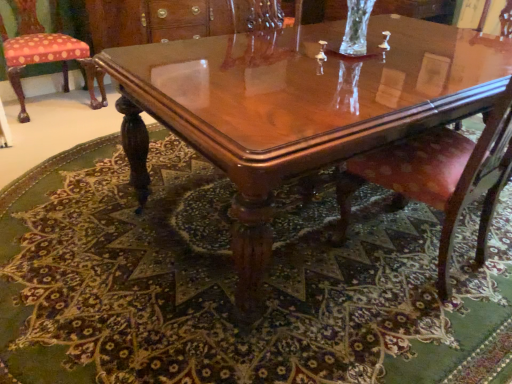
Question: From a real-world perspective, is polka dot fabric cushion at left, marked as the 1th chair in a top-to-bottom arrangement, above or below carpeted floor at center?

Choices:
 (A) below
 (B) above

Answer: (B)

Question: From the image's perspective, relative to carpeted floor at center, is polka dot fabric cushion at left, marked as the 1th chair in a top-to-bottom arrangement, above or below?

Choices:
 (A) below
 (B) above

Answer: (B)

Question: Based on their relative distances, which object is nearer to the polka dot fabric cushion at left, the 2th chair from the front?

Choices:
 (A) pink velvet chair at center, acting as the second chair starting from the left
 (B) carpeted floor at center
 (C) glossy wood coffee table at center

Answer: (B)

Question: Which is nearer to the pink velvet chair at center, which ranks as the first chair in right-to-left order?

Choices:
 (A) glossy wood coffee table at center
 (B) polka dot fabric cushion at left, which ranks as the second chair in right-to-left order
 (C) carpeted floor at center

Answer: (A)